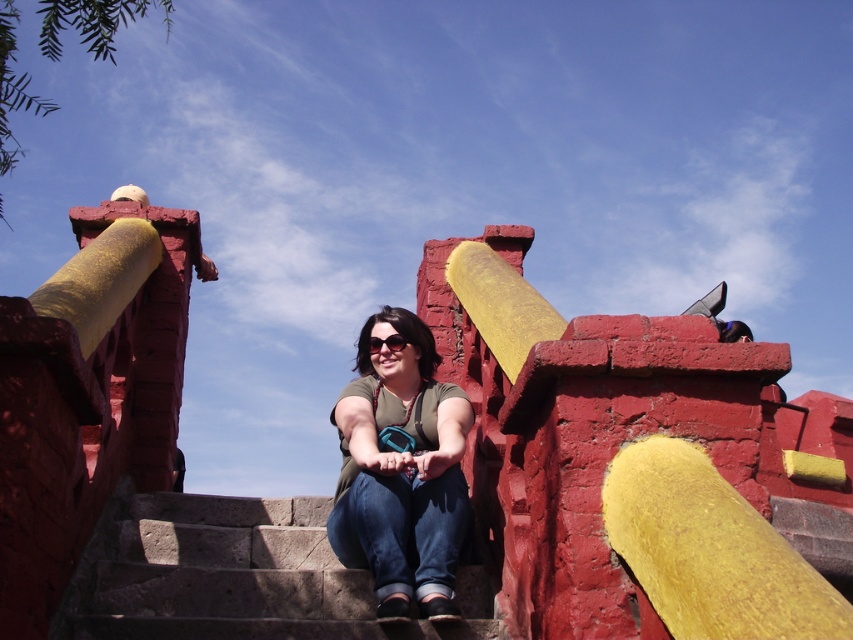
You are a photographer trying to capture the person sitting on the stone steps. You want to place a small flag exactly at point [401,472]. According to the scene description, where should you place the flag relative to the person?

The point [401,472] is on the matte green shirt at center, so you should place the flag on the person at the center of their green shirt.

You are a photographer trying to capture the perfect shot of the person wearing the matte green shirt at center. To ensure the shirt is in the exact center of your photo, where should you position your camera? Please provide coordinates based on the image grid system where the bottom left corner is the origin point.

The matte green shirt at center is located at coordinates point [401,472], so position the camera to center the shot at those coordinates to ensure the shirt is precisely centered.